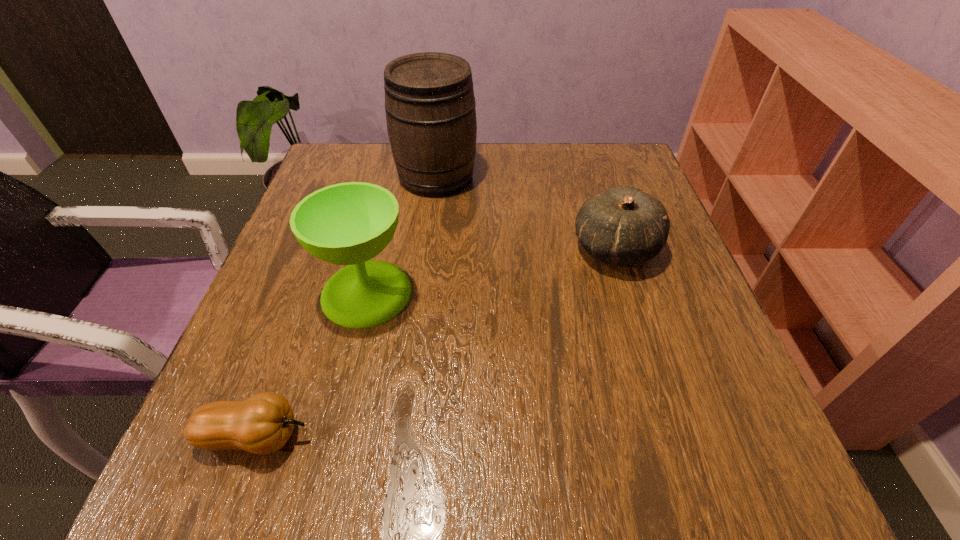
The image size is (960, 540). I want to click on vacant area located on the stem side of the nearest object, so coord(533,436).

Locate an element on the screen. Image resolution: width=960 pixels, height=540 pixels. object that is at the far edge is located at coordinates (430, 109).

I want to click on object situated at the near edge, so click(262, 424).

This screenshot has width=960, height=540. Identify the location of wineglass at the left edge. (350, 223).

Image resolution: width=960 pixels, height=540 pixels. I want to click on gourd at the left edge, so click(x=262, y=424).

Locate an element on the screen. object present at the right edge is located at coordinates (624, 226).

Locate an element on the screen. This screenshot has width=960, height=540. object present at the near left corner is located at coordinates (262, 424).

Where is `vacant space at the far edge of the desktop`? The height and width of the screenshot is (540, 960). vacant space at the far edge of the desktop is located at coordinates (552, 194).

Where is `free region at the near edge`? The width and height of the screenshot is (960, 540). free region at the near edge is located at coordinates (502, 451).

Find the location of a particular element. blank space at the left edge is located at coordinates (293, 375).